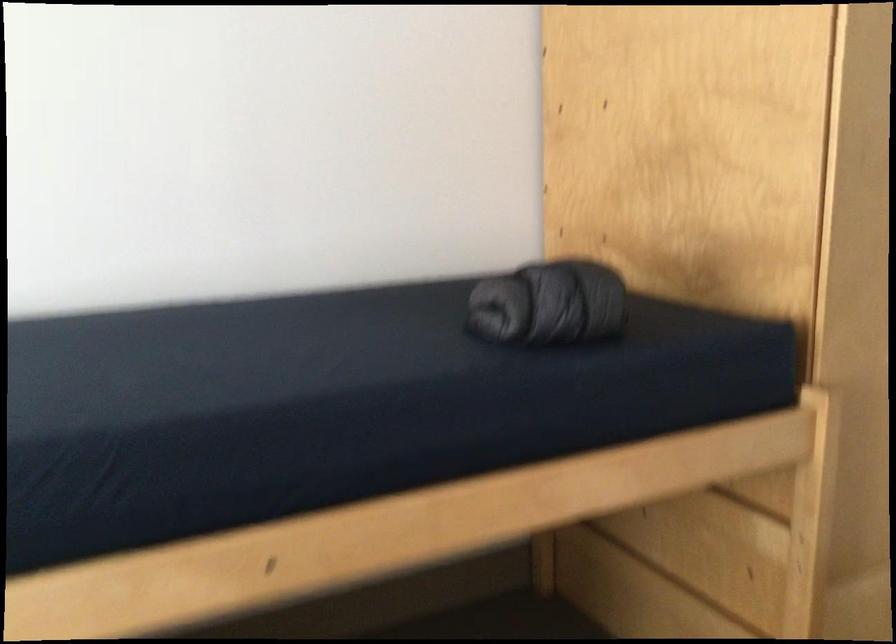
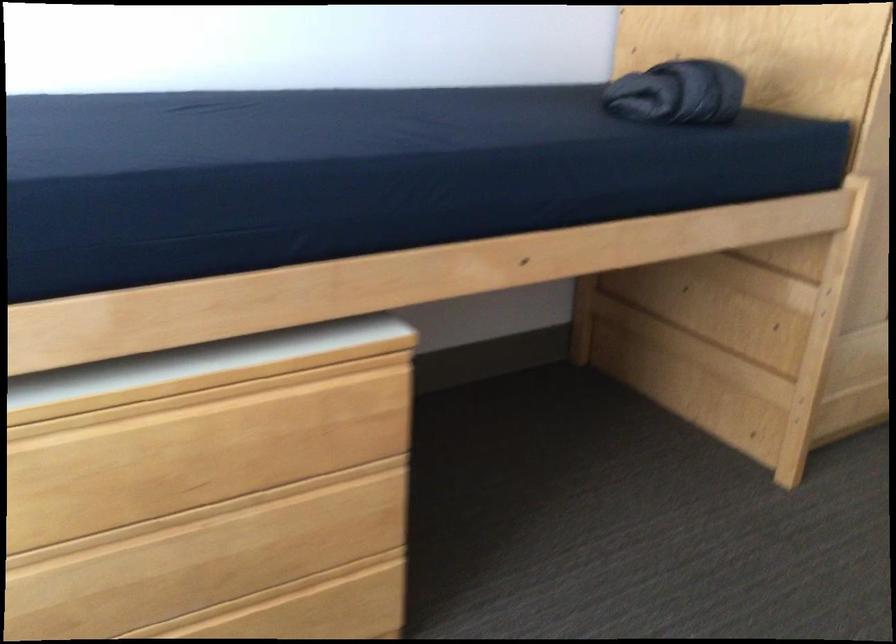
Question: The first image is from the beginning of the video and the second image is from the end. How did the camera likely rotate when shooting the video?

Choices:
 (A) Left
 (B) Right
 (C) Up
 (D) Down

Answer: (D)